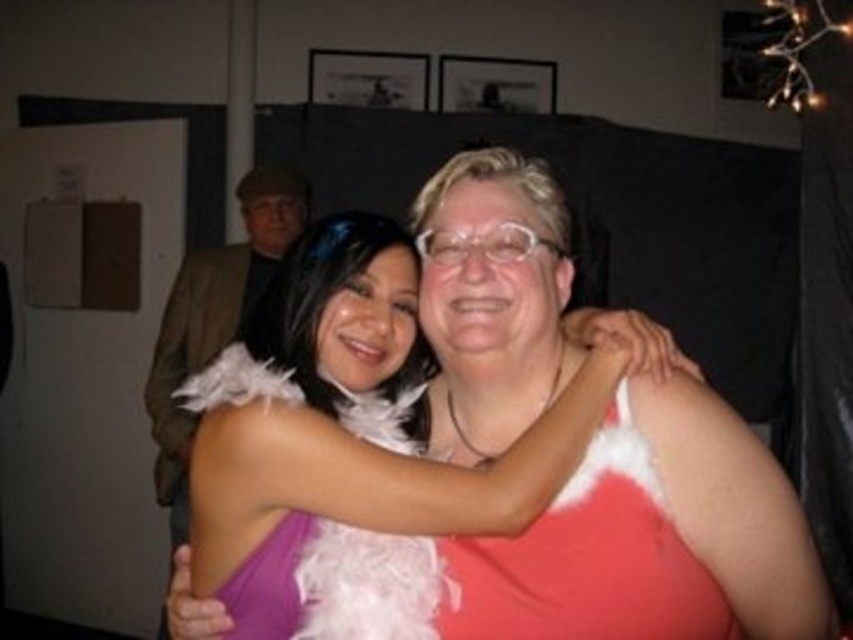
Does white feather boa at center lie behind brown woolen jacket at upper left?

No, white feather boa at center is in front of brown woolen jacket at upper left.

Is point (793, 564) behind point (171, 372)?

No.

Find the location of a particular element. white feather boa at center is located at coordinates (730, 513).

Which of these two, white feather boa at center or purple feathered dress at center, stands taller?

white feather boa at center is taller.

Is white feather boa at center positioned in front of purple feathered dress at center?

Yes.

The height and width of the screenshot is (640, 853). What do you see at coordinates (730, 513) in the screenshot? I see `white feather boa at center` at bounding box center [730, 513].

Where is `white feather boa at center`? The height and width of the screenshot is (640, 853). white feather boa at center is located at coordinates (730, 513).

Between purple feathered dress at center and brown woolen jacket at upper left, which one is positioned higher?

brown woolen jacket at upper left is above.

Does purple feathered dress at center appear over brown woolen jacket at upper left?

No.

You are a GUI agent. You are given a task and a screenshot of the screen. Output one action in this format:
    pyautogui.click(x=<x>, y=<y>)
    Task: Click on the purple feathered dress at center
    This screenshot has height=640, width=853.
    Given the screenshot: What is the action you would take?
    pyautogui.click(x=589, y=561)

The height and width of the screenshot is (640, 853). I want to click on purple feathered dress at center, so pyautogui.click(x=589, y=561).